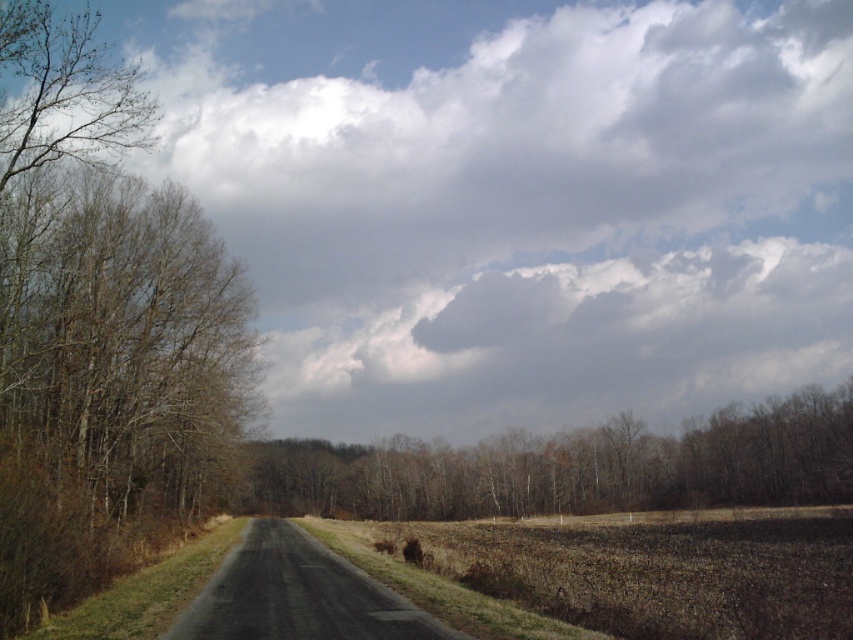
Question: Which point is farther to the camera?

Choices:
 (A) (357, 291)
 (B) (363, 509)

Answer: (A)

Question: Is brown leafless tree at left positioned behind brown/dry wood trees at center?

Choices:
 (A) no
 (B) yes

Answer: (A)

Question: Is cloudy sky at upper center below brown/dry wood trees at center?

Choices:
 (A) yes
 (B) no

Answer: (B)

Question: Estimate the real-world distances between objects in this image. Which object is closer to the cloudy sky at upper center?

Choices:
 (A) brown leafless tree at left
 (B) brown/dry wood trees at center

Answer: (B)

Question: Can you confirm if cloudy sky at upper center is thinner than brown/dry wood trees at center?

Choices:
 (A) yes
 (B) no

Answer: (B)

Question: Which of the following is the farthest from the observer?

Choices:
 (A) brown leafless tree at left
 (B) cloudy sky at upper center
 (C) brown/dry wood trees at center

Answer: (C)